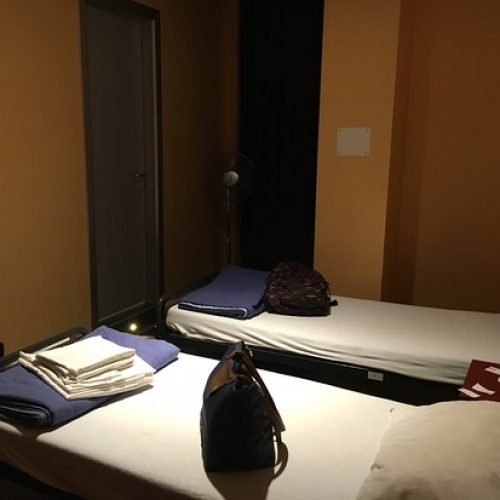
At what (x,y) coordinates should I click in order to perform the action: click on blue blanket. Please return your answer as a coordinate pair (x, y). Looking at the image, I should click on (30, 385), (228, 301).